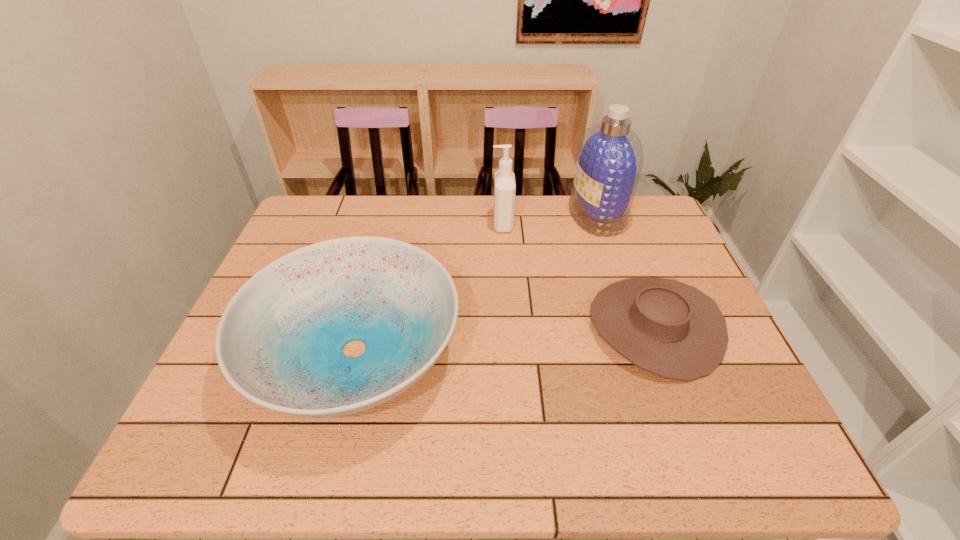
The image size is (960, 540). In order to click on the right cleansing agent in this screenshot , I will do `click(610, 157)`.

Where is `the taller cleansing agent`? the taller cleansing agent is located at coordinates (610, 157).

At what (x,y) coordinates should I click in order to perform the action: click on the left cleansing agent. Please return your answer as a coordinate pair (x, y). The width and height of the screenshot is (960, 540). Looking at the image, I should click on (504, 182).

Identify the location of the second tallest object. The image size is (960, 540). (504, 182).

This screenshot has width=960, height=540. Identify the location of the third tallest object. (279, 343).

Image resolution: width=960 pixels, height=540 pixels. In order to click on the leftmost object in this screenshot , I will do `click(279, 343)`.

The width and height of the screenshot is (960, 540). In order to click on the shortest object in this screenshot , I will do 668,328.

I want to click on vacant space located on the left of the right cleansing agent, so click(521, 216).

The image size is (960, 540). I want to click on vacant space located on the front label of the second object from left to right, so click(x=392, y=224).

Identify the location of blank space located 0.190m on the front label of the second object from left to right. The height and width of the screenshot is (540, 960). (432, 224).